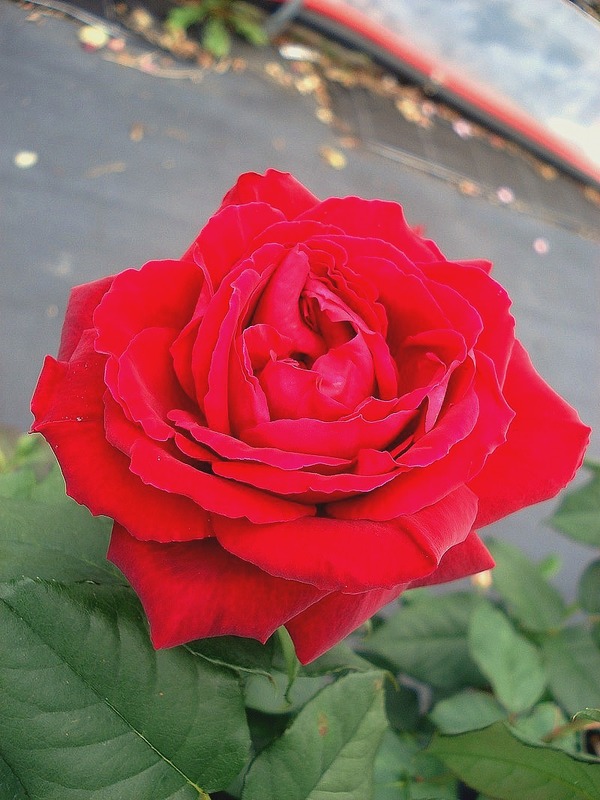
This screenshot has height=800, width=600. What are the coordinates of `wall` in the screenshot? It's located at (514, 62).